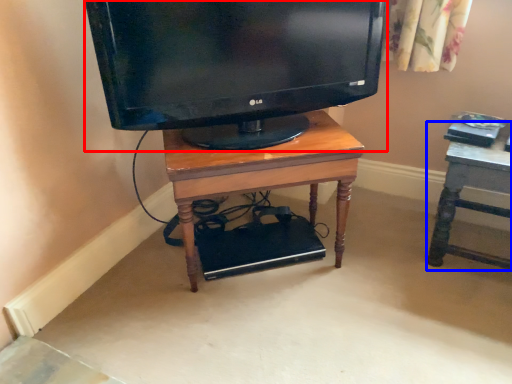
Question: Which object is closer to the camera taking this photo, television (highlighted by a red box) or furniture (highlighted by a blue box)?

Choices:
 (A) television
 (B) furniture

Answer: (A)